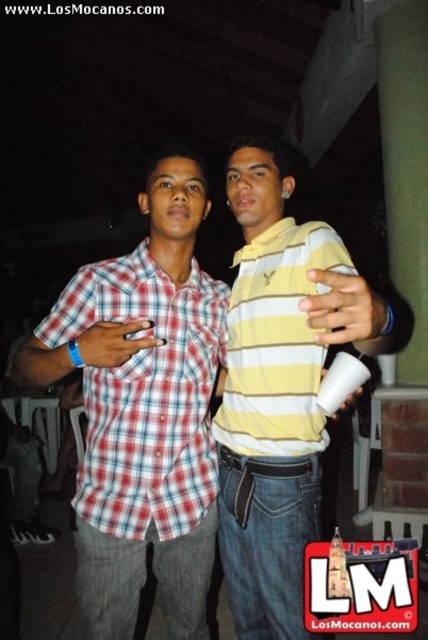
You are a photographer trying to capture a candid shot of two people in the scene. You notice two specific points marked in the image. Which point, point 1 at coordinates (100, 627) or point 2 at coordinates (259, 252), is closer to the camera and would be the best focus point for the photo?

Point 1 at coordinates (100, 627) is in front of point 2 at coordinates (259, 252), so it is closer to the camera and would be the best focus point for the photo.

From the picture: You are a photographer trying to capture a clear photo of the two people in the scene. The camera has a minimum focus distance of 10 inches. Based on the scene, will the camera be able to focus on both the red plaid shirt at center and the yellow striped polo shirt at center simultaneously?

The red plaid shirt at center is 9.97 inches from the yellow striped polo shirt at center, which is less than the camera minimum focus distance of 10 inches. Therefore, the camera will not be able to focus on both the red plaid shirt at center and the yellow striped polo shirt at center simultaneously.

You are trying to decide which person to approach based on their clothing. You see the red plaid shirt at center and the yellow striped polo at center. Which one is on the left side?

The red plaid shirt at center is positioned on the left side of the yellow striped polo at center, so the red plaid shirt at center is on the left.